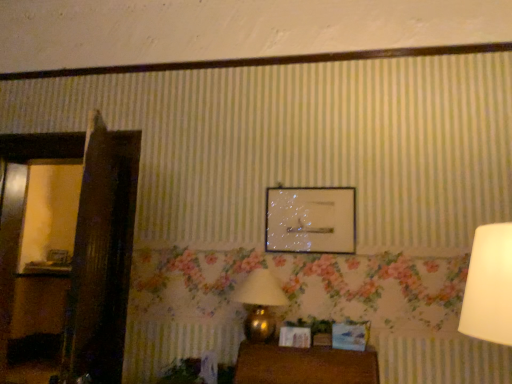
Question: Can you confirm if gold metallic table lamp at lower center is bigger than clear glass picture frame at center, the first picture frame when ordered from top to bottom?

Choices:
 (A) no
 (B) yes

Answer: (B)

Question: From a real-world perspective, is gold metallic table lamp at lower center below clear glass picture frame at center, the 2th picture frame positioned from the left?

Choices:
 (A) yes
 (B) no

Answer: (A)

Question: Is gold metallic table lamp at lower center not inside clear glass picture frame at center, the 2th picture frame positioned from the left?

Choices:
 (A) yes
 (B) no

Answer: (A)

Question: Considering the relative sizes of gold metallic table lamp at lower center and clear glass picture frame at center, the first picture frame when ordered from top to bottom, in the image provided, is gold metallic table lamp at lower center shorter than clear glass picture frame at center, the first picture frame when ordered from top to bottom,?

Choices:
 (A) yes
 (B) no

Answer: (B)

Question: Is clear glass picture frame at center, positioned as the second picture frame in bottom-to-top order, at the back of gold metallic table lamp at lower center?

Choices:
 (A) no
 (B) yes

Answer: (A)

Question: Is gold metallic table lamp at lower center closer to camera compared to clear glass picture frame at center, which is the second picture frame from back to front?

Choices:
 (A) yes
 (B) no

Answer: (A)

Question: Can you confirm if wooden picture frame at left, which is the second picture frame from right to left, is positioned to the right of gold metallic table lamp at lower center?

Choices:
 (A) no
 (B) yes

Answer: (A)

Question: Can you see wooden picture frame at left, marked as the first picture frame in a back-to-front arrangement, touching gold metallic table lamp at lower center?

Choices:
 (A) no
 (B) yes

Answer: (A)

Question: Is wooden picture frame at left, which is counted as the 1th picture frame, starting from the bottom, not within gold metallic table lamp at lower center?

Choices:
 (A) no
 (B) yes

Answer: (B)

Question: Is wooden picture frame at left, which appears as the 2th picture frame when viewed from the front, smaller than gold metallic table lamp at lower center?

Choices:
 (A) no
 (B) yes

Answer: (B)

Question: Could gold metallic table lamp at lower center be considered to be inside wooden picture frame at left, which is the second picture frame from right to left?

Choices:
 (A) yes
 (B) no

Answer: (B)

Question: From the image's perspective, is wooden picture frame at left, which appears as the 2th picture frame when viewed from the front, beneath gold metallic table lamp at lower center?

Choices:
 (A) yes
 (B) no

Answer: (A)

Question: From the image's perspective, is wooden table at lower center on wooden picture frame at left, marked as the first picture frame in a back-to-front arrangement?

Choices:
 (A) no
 (B) yes

Answer: (A)